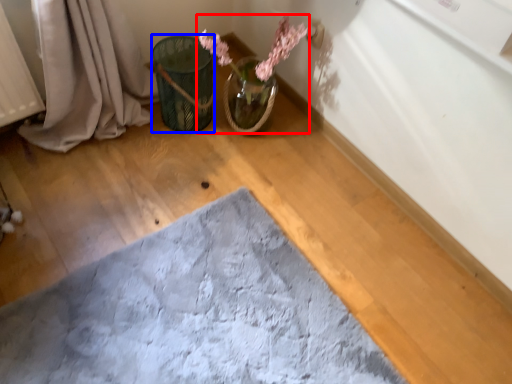
Question: Which object appears farthest to the camera in this image, floral arrangement (highlighted by a red box) or flower basket (highlighted by a blue box)?

Choices:
 (A) floral arrangement
 (B) flower basket

Answer: (B)